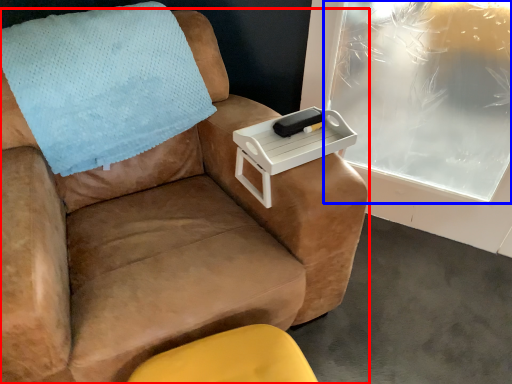
Question: Which of the following is the closest to the observer, chair (highlighted by a red box) or window screen (highlighted by a blue box)?

Choices:
 (A) chair
 (B) window screen

Answer: (A)